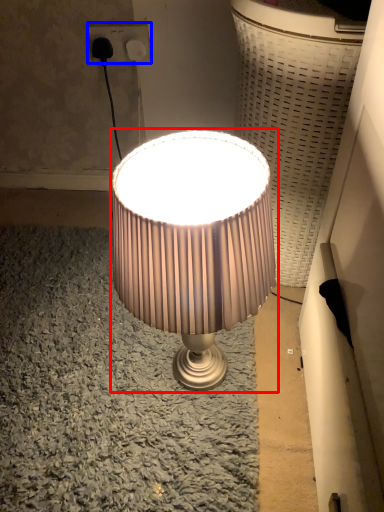
Question: Which object appears farthest to the camera in this image, lamp (highlighted by a red box) or electric outlet (highlighted by a blue box)?

Choices:
 (A) lamp
 (B) electric outlet

Answer: (B)